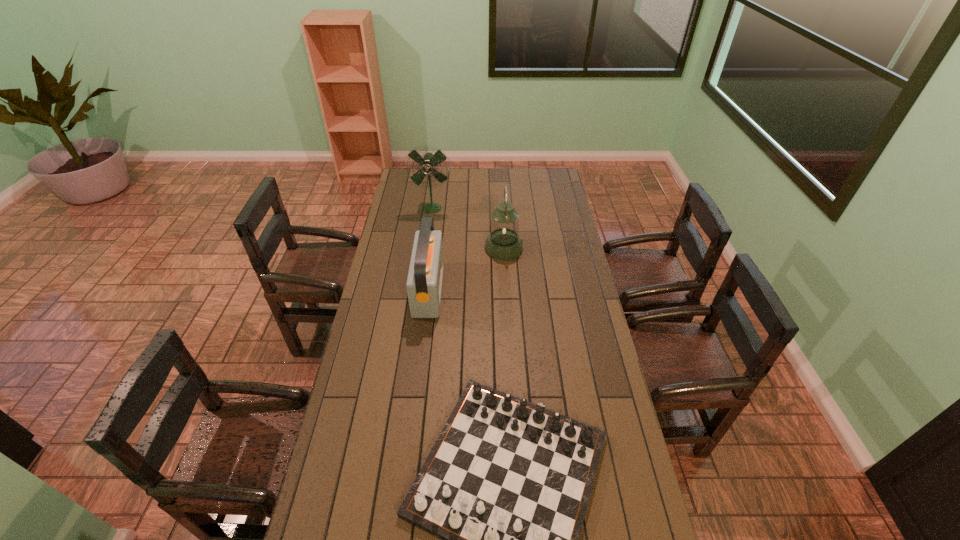
This screenshot has height=540, width=960. I want to click on the farthest object, so click(x=426, y=164).

Locate an element on the screen. fan is located at coordinates (426, 164).

Locate an element on the screen. The width and height of the screenshot is (960, 540). the second farthest object is located at coordinates (503, 243).

Identify the location of radio receiver. The height and width of the screenshot is (540, 960). (424, 282).

You are a GUI agent. You are given a task and a screenshot of the screen. Output one action in this format:
    pyautogui.click(x=<x>, y=<y>)
    Task: Click on the vacant space located on the front-facing side of the farthest object
    
    Given the screenshot: What is the action you would take?
    pyautogui.click(x=429, y=233)

Locate an element on the screen. The height and width of the screenshot is (540, 960). free space located 0.120m on the back of the second farthest object is located at coordinates (502, 222).

Locate an element on the screen. This screenshot has width=960, height=540. free region located on the front-facing side of the radio receiver is located at coordinates (492, 289).

At what (x,y) coordinates should I click in order to perform the action: click on object that is at the left edge. Please return your answer as a coordinate pair (x, y). Looking at the image, I should click on (426, 164).

The width and height of the screenshot is (960, 540). I want to click on vacant region at the far edge of the desktop, so click(444, 171).

In the image, there is a desktop. Identify the location of vacant space at the left edge. Image resolution: width=960 pixels, height=540 pixels. (404, 262).